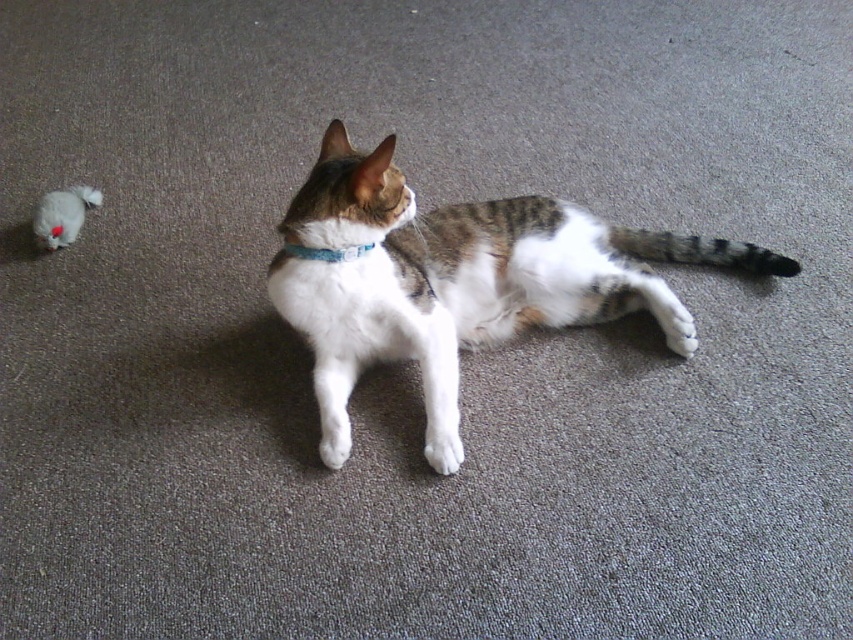
Can you confirm if white fur at lower center is thinner than blue fabric neckband at center?

Indeed, white fur at lower center has a lesser width compared to blue fabric neckband at center.

Who is more forward, (x=436, y=460) or (x=297, y=244)?

Point (x=436, y=460) is in front.

Who is more forward, (457, 449) or (352, 257)?

Positioned in front is point (457, 449).

The height and width of the screenshot is (640, 853). Find the location of `white fur at lower center`. white fur at lower center is located at coordinates (444, 449).

Is point (326, 381) farther from camera compared to point (430, 445)?

Yes, point (326, 381) is behind point (430, 445).

Can you confirm if white fur cat at center is bigger than white fur at lower center?

Indeed, white fur cat at center has a larger size compared to white fur at lower center.

Is point (341, 244) closer to viewer compared to point (427, 445)?

Yes, point (341, 244) is in front of point (427, 445).

Identify the location of white fur cat at center. (462, 273).

Does white fur cat at center have a greater height compared to white fur paw at lower center?

Yes.

The height and width of the screenshot is (640, 853). Describe the element at coordinates (462, 273) in the screenshot. I see `white fur cat at center` at that location.

Locate an element on the screen. white fur cat at center is located at coordinates (462, 273).